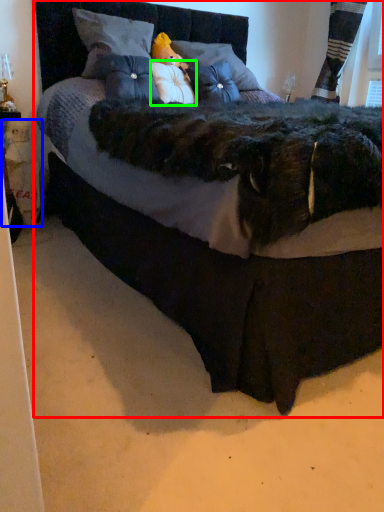
Question: Which is farther away from bed (highlighted by a red box)? doll (highlighted by a blue box) or pillow (highlighted by a green box)?

Choices:
 (A) doll
 (B) pillow

Answer: (B)